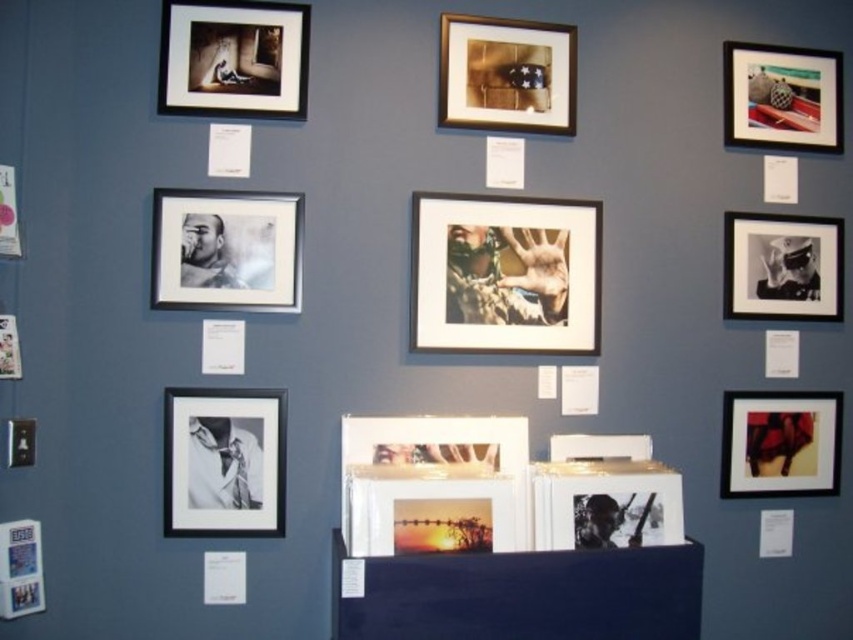
Who is more distant from viewer, (531,323) or (466,536)?

Positioned behind is point (531,323).

Between matte paper print at center and white glossy photo frame at center, which one has more height?

matte paper print at center is taller.

Find the location of a particular element. The width and height of the screenshot is (853, 640). matte paper print at center is located at coordinates (505, 273).

Does black matte photo frame at lower left come behind black glossy photo frame at lower center?

Yes, black matte photo frame at lower left is behind black glossy photo frame at lower center.

Image resolution: width=853 pixels, height=640 pixels. Find the location of `black matte photo frame at lower left`. black matte photo frame at lower left is located at coordinates (224, 461).

Where is `black matte photo frame at lower left`? black matte photo frame at lower left is located at coordinates (224, 461).

Where is `white glossy photo frame at center`? The width and height of the screenshot is (853, 640). white glossy photo frame at center is located at coordinates (434, 484).

Does white glossy photo frame at center have a lesser height compared to black matte photo frame at upper left?

Indeed, white glossy photo frame at center has a lesser height compared to black matte photo frame at upper left.

Is point (363, 486) in front of point (154, 220)?

Yes, point (363, 486) is in front of point (154, 220).

Image resolution: width=853 pixels, height=640 pixels. I want to click on white glossy photo frame at center, so click(434, 484).